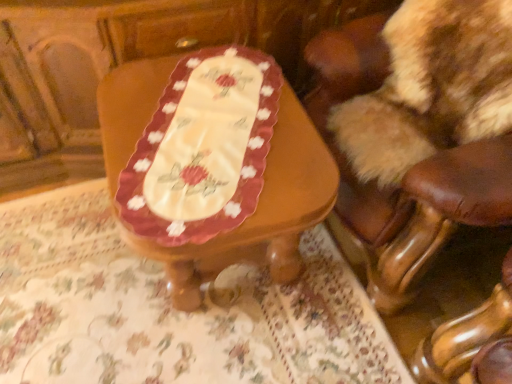
Question: Does wooden table at center appear on the right side of beige fabric tablecloth at center?

Choices:
 (A) yes
 (B) no

Answer: (B)

Question: Would you say wooden table at center is a long distance from beige fabric tablecloth at center?

Choices:
 (A) yes
 (B) no

Answer: (B)

Question: Is the position of wooden table at center more distant than that of beige fabric tablecloth at center?

Choices:
 (A) yes
 (B) no

Answer: (B)

Question: Does wooden table at center have a smaller size compared to beige fabric tablecloth at center?

Choices:
 (A) no
 (B) yes

Answer: (A)

Question: From the image's perspective, is wooden table at center below beige fabric tablecloth at center?

Choices:
 (A) yes
 (B) no

Answer: (B)

Question: From a real-world perspective, is brown leather chair at upper right above or below beige fabric tablecloth at center?

Choices:
 (A) below
 (B) above

Answer: (B)

Question: Is brown leather chair at upper right inside the boundaries of beige fabric tablecloth at center, or outside?

Choices:
 (A) outside
 (B) inside

Answer: (A)

Question: Considering the positions of brown leather chair at upper right and beige fabric tablecloth at center in the image, is brown leather chair at upper right wider or thinner than beige fabric tablecloth at center?

Choices:
 (A) thin
 (B) wide

Answer: (A)

Question: Does point (366, 233) appear closer or farther from the camera than point (75, 311)?

Choices:
 (A) farther
 (B) closer

Answer: (B)

Question: Is beige fabric tablecloth at center wider or thinner than brown leather chair at upper right?

Choices:
 (A) thin
 (B) wide

Answer: (B)

Question: From a real-world perspective, is beige fabric tablecloth at center above or below brown leather chair at upper right?

Choices:
 (A) below
 (B) above

Answer: (A)

Question: From the image's perspective, is beige fabric tablecloth at center above or below brown leather chair at upper right?

Choices:
 (A) above
 (B) below

Answer: (B)

Question: Is beige fabric tablecloth at center taller or shorter than brown leather chair at upper right?

Choices:
 (A) short
 (B) tall

Answer: (A)

Question: From a real-world perspective, relative to beige fabric tablecloth at center, is wooden table at center vertically above or below?

Choices:
 (A) above
 (B) below

Answer: (A)

Question: From the image's perspective, is wooden table at center above or below beige fabric tablecloth at center?

Choices:
 (A) below
 (B) above

Answer: (B)